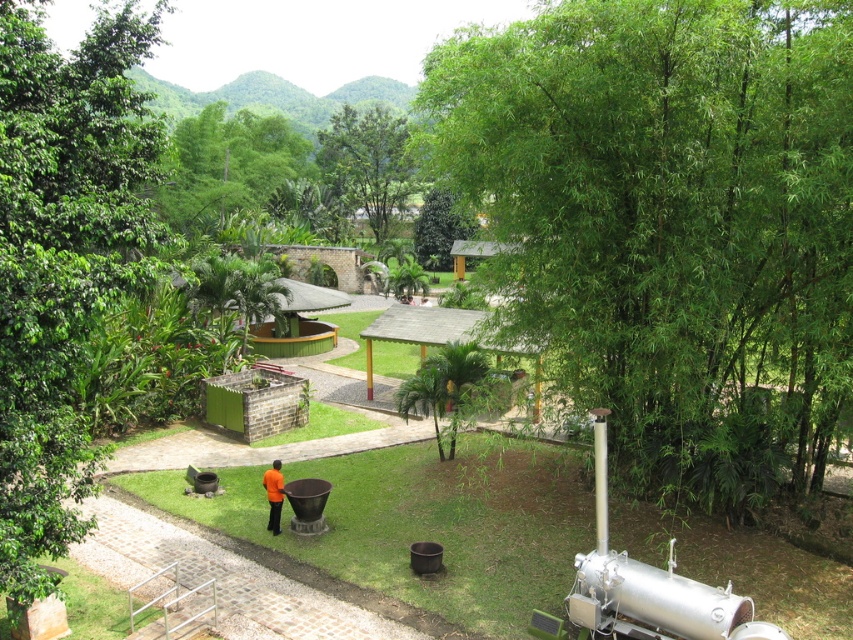
Question: Is green leafy tree at left wider than green leafy tree at center?

Choices:
 (A) yes
 (B) no

Answer: (A)

Question: Which of these objects is positioned farthest from the green leafy tree at center?

Choices:
 (A) green leafy tree at left
 (B) green leafy tree at upper center
 (C) green leafy tree at upper left

Answer: (A)

Question: Does green leafy tree at upper center have a smaller size compared to green leafy tree at center?

Choices:
 (A) yes
 (B) no

Answer: (A)

Question: Which object is positioned farthest from the green leafy tree at upper center?

Choices:
 (A) green leafy tree at center
 (B) green leafy bamboo at right

Answer: (B)

Question: Does green leafy tree at upper left appear over green leafy tree at upper center?

Choices:
 (A) yes
 (B) no

Answer: (B)

Question: Which point is farther to the camera?

Choices:
 (A) green leafy tree at upper center
 (B) green leafy tree at left
 (C) green leafy bamboo at right

Answer: (A)